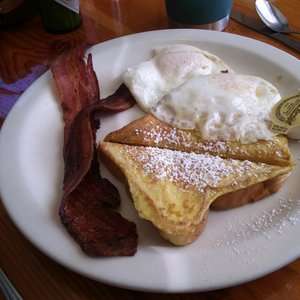
The width and height of the screenshot is (300, 300). Identify the location of white plate. (54, 134).